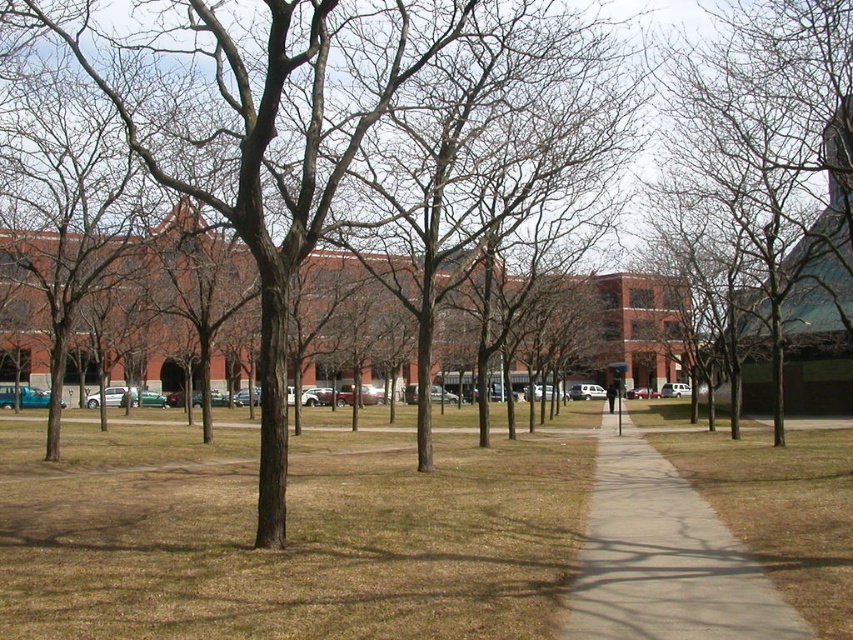
Can you confirm if bare wood tree at upper right is positioned below concrete sidewalk at center?

No, bare wood tree at upper right is not below concrete sidewalk at center.

Which of these two, bare wood tree at upper right or concrete sidewalk at center, stands taller?

Standing taller between the two is bare wood tree at upper right.

The width and height of the screenshot is (853, 640). Describe the element at coordinates (773, 140) in the screenshot. I see `bare wood tree at upper right` at that location.

The image size is (853, 640). In order to click on bare wood tree at upper right in this screenshot , I will do `click(773, 140)`.

Is point (410, 604) behind point (627, 582)?

No, it is not.

Is brown dry grass at center bigger than concrete sidewalk at center?

Yes, brown dry grass at center is bigger than concrete sidewalk at center.

Who is more forward, (312, 632) or (570, 589)?

Point (312, 632) is in front.

Identify the location of brown dry grass at center. The height and width of the screenshot is (640, 853). (288, 538).

Who is lower down, brown dry grass at center or bare wood tree at upper right?

brown dry grass at center

Consider the image. Who is higher up, brown dry grass at center or bare wood tree at upper right?

bare wood tree at upper right is above.

Where is `brown dry grass at center`? brown dry grass at center is located at coordinates (288, 538).